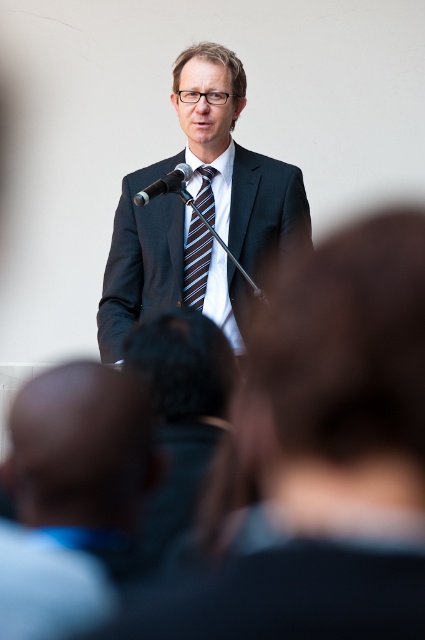
Based on the scene description, where is the dark blue suit at center located in terms of coordinates?

The dark blue suit at center is located at coordinates point (201, 211).